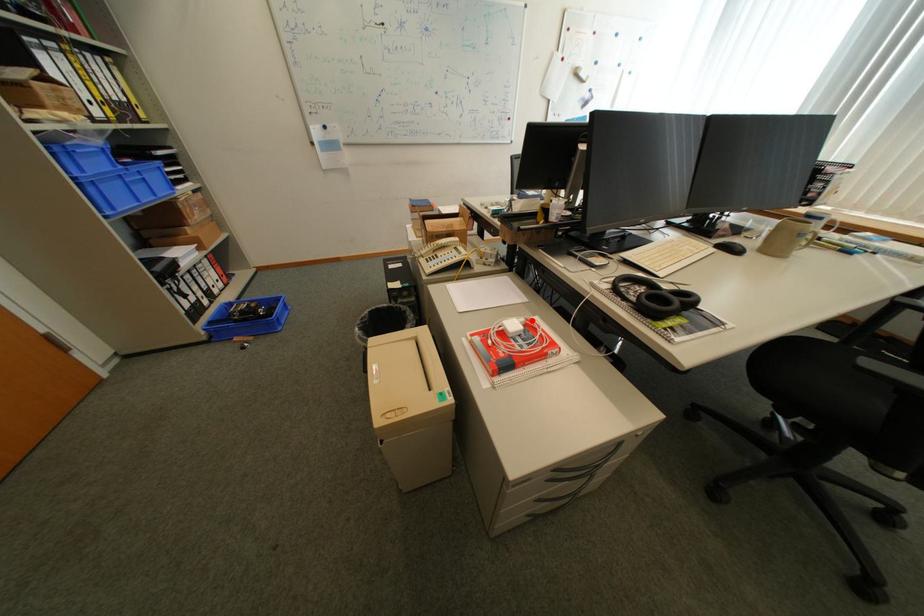
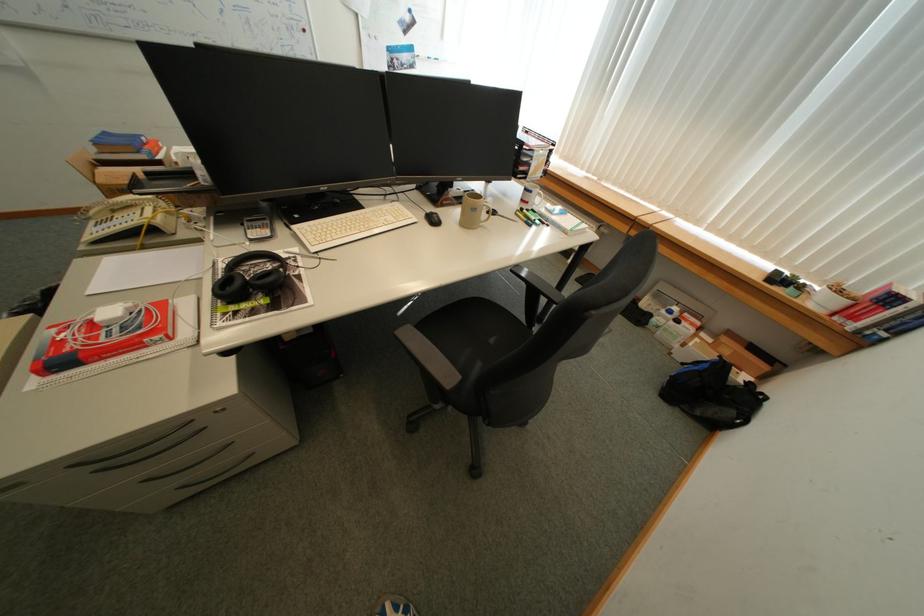
The point at the highlighted location is marked in the first image. Where is the corresponding point in the second image?

(140, 305)